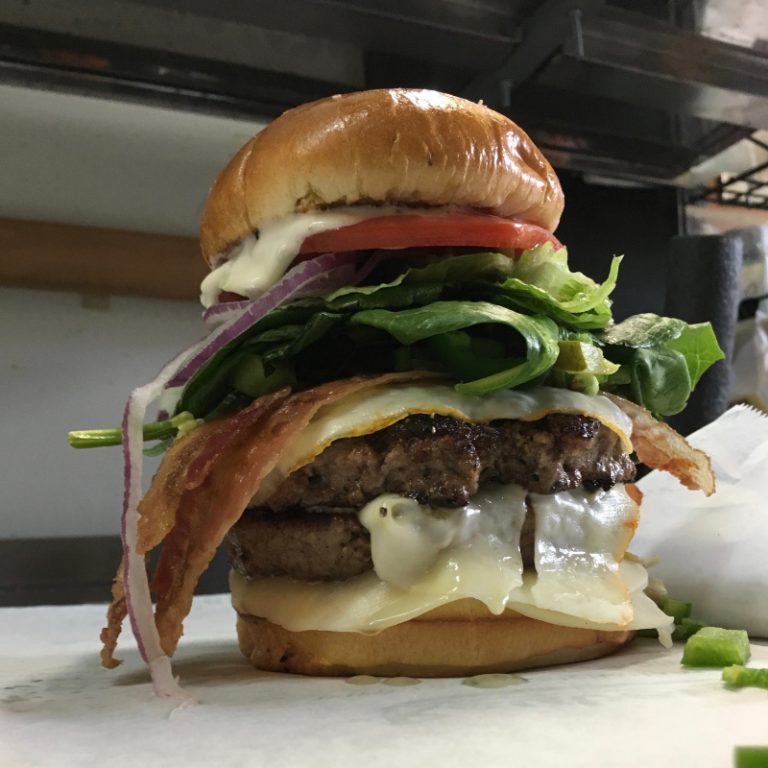
Image resolution: width=768 pixels, height=768 pixels. What are the coordinates of `ceiling` in the screenshot? It's located at (650, 5).